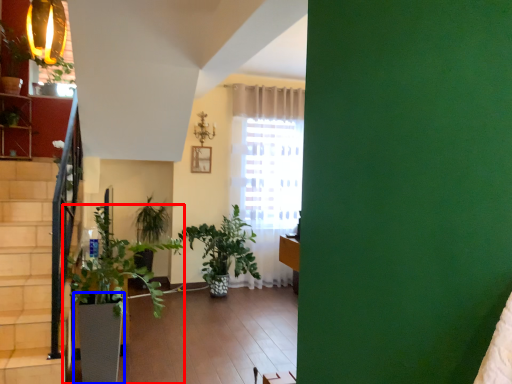
Question: Which object is further to the camera taking this photo, houseplant (highlighted by a red box) or flowerpot (highlighted by a blue box)?

Choices:
 (A) houseplant
 (B) flowerpot

Answer: (B)